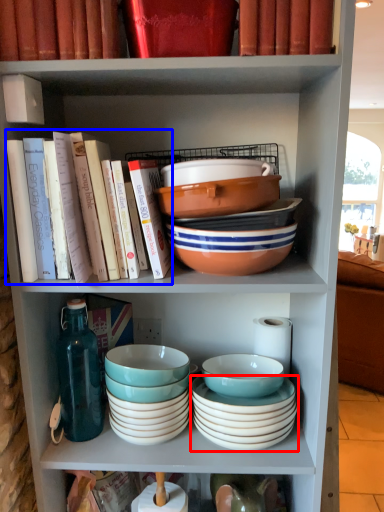
Question: Among these objects, which one is nearest to the camera, bowl (highlighted by a red box) or book (highlighted by a blue box)?

Choices:
 (A) bowl
 (B) book

Answer: (B)